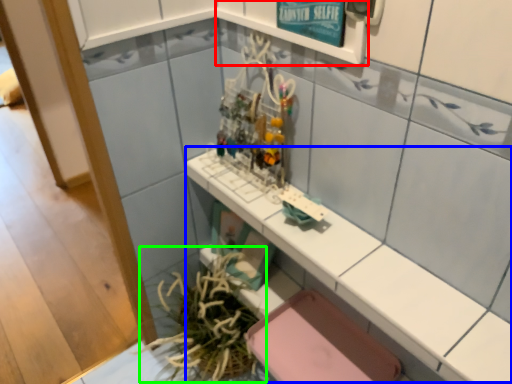
Question: Which object is positioned closest to shelf (highlighted by a red box)? Select from counter top (highlighted by a blue box) and plant (highlighted by a green box).

Choices:
 (A) counter top
 (B) plant

Answer: (A)